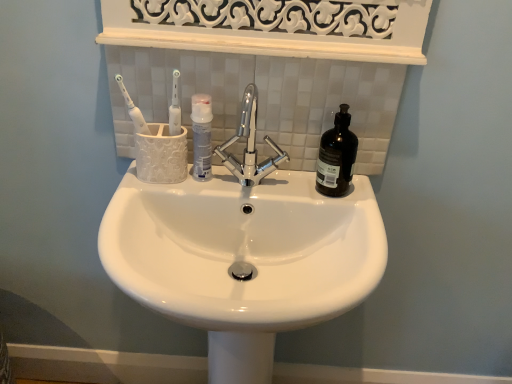
Find the location of `vacant space positioned to the left of black glass bottle at right, which ranks as the first mouthwash in right-to-left order`. vacant space positioned to the left of black glass bottle at right, which ranks as the first mouthwash in right-to-left order is located at coordinates (269, 180).